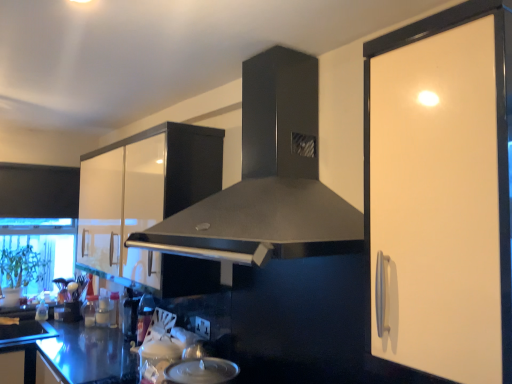
Question: Relative to matte black knife block at lower left, arranged as the first appliance when viewed from the left, is matte black range hood at center in front or behind?

Choices:
 (A) front
 (B) behind

Answer: (A)

Question: Is point [300, 112] closer or farther from the camera than point [79, 314]?

Choices:
 (A) farther
 (B) closer

Answer: (B)

Question: Which is nearer to the satin silver lid at lower center?

Choices:
 (A) shiny metallic bottle at lower left, the 1th appliance in the right-to-left sequence
 (B) glossy white cabinet at upper left
 (C) matte black knife block at lower left, arranged as the 1th appliance when viewed from the back
 (D) transparent glass window screen at lower left
 (E) matte black range hood at center

Answer: (E)

Question: Considering the real-world distances, which object is closest to the matte black knife block at lower left, arranged as the 1th appliance when viewed from the back?

Choices:
 (A) matte black range hood at center
 (B) white glossy cabinet handle at right
 (C) shiny metallic bottle at lower left, which is the 2th appliance from left to right
 (D) glossy white cabinet at upper left
 (E) satin silver lid at lower center

Answer: (C)